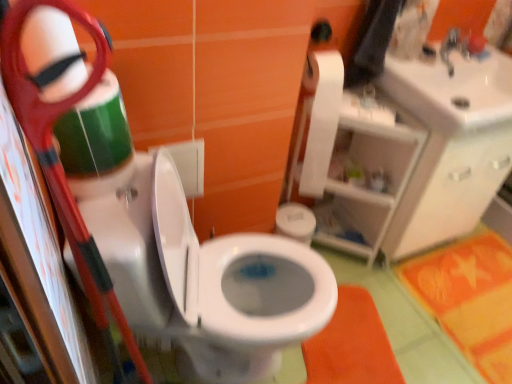
Question: Considering the positions of point (315, 134) and point (380, 327), is point (315, 134) closer or farther from the camera than point (380, 327)?

Choices:
 (A) closer
 (B) farther

Answer: (A)

Question: Is white matte toilet paper at upper right taller or shorter than orange fabric bath mat at lower center, the second bath mat viewed from the right?

Choices:
 (A) tall
 (B) short

Answer: (A)

Question: Which is farther from the orange fabric bath mat at lower center, the second bath mat viewed from the right?

Choices:
 (A) orange/yellow fabric bath mat at lower right, the 2th bath mat from the left
 (B) green plastic scissors at left
 (C) white glossy sink at upper right
 (D) white glossy toilet at center
 (E) white matte toilet paper at upper right

Answer: (B)

Question: Estimate the real-world distances between objects in this image. Which object is closer to the green plastic scissors at left?

Choices:
 (A) orange/yellow fabric bath mat at lower right, the first bath mat positioned from the right
 (B) white glossy sink at upper right
 (C) white plastic shelf at upper right
 (D) orange fabric bath mat at lower center, the second bath mat viewed from the right
 (E) white matte toilet paper at upper right

Answer: (D)